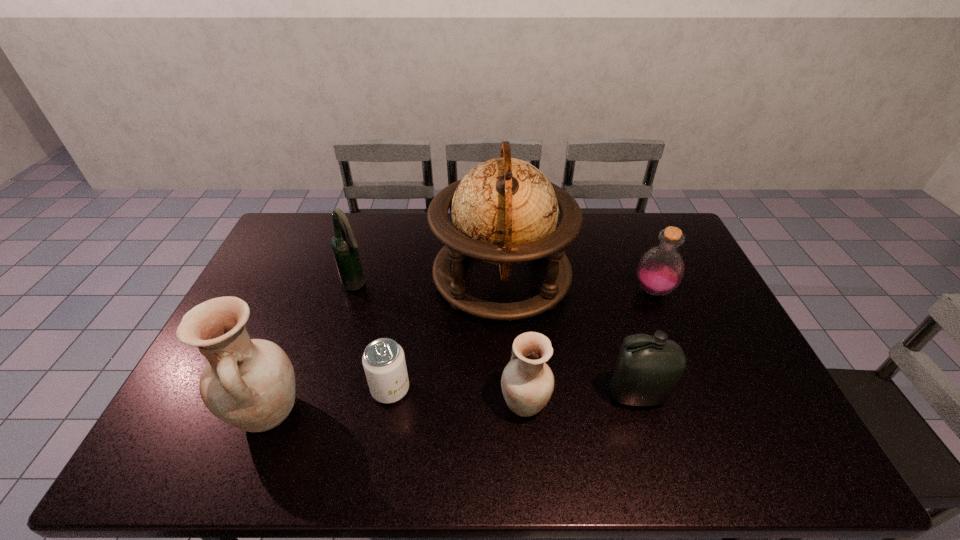
Identify the location of vacant area situated 0.290m on the back of the taller pottery. The image size is (960, 540). tap(311, 303).

What are the coordinates of `free space located 0.380m on the left of the right pottery` in the screenshot? It's located at (351, 403).

The height and width of the screenshot is (540, 960). Find the location of `vacant space positioned 0.110m on the back of the globe`. vacant space positioned 0.110m on the back of the globe is located at coordinates (498, 219).

I want to click on vacant region located on the back of the beer bottle, so click(376, 218).

Where is `vacant space located on the left of the right bottle`? vacant space located on the left of the right bottle is located at coordinates (583, 291).

This screenshot has height=540, width=960. I want to click on vacant region located on the left of the nearer bottle, so click(x=581, y=395).

This screenshot has width=960, height=540. Identify the location of vacant position located 0.370m on the left of the fifth object from right to left. (230, 389).

Identify the location of object that is at the far edge. (504, 211).

The width and height of the screenshot is (960, 540). What are the coordinates of `bottle located at the near edge` in the screenshot? It's located at (648, 368).

The image size is (960, 540). Find the location of `soda can located in the near edge section of the desktop`. soda can located in the near edge section of the desktop is located at coordinates (384, 363).